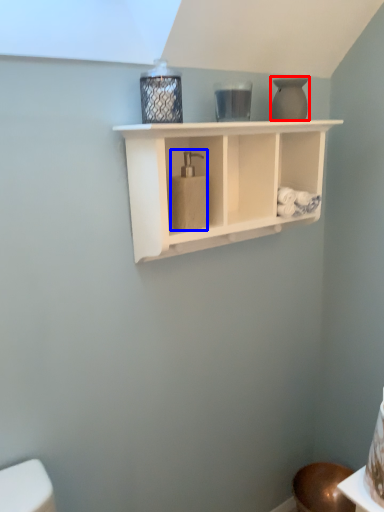
Question: Which point is closer to the camera, vase (highlighted by a red box) or soap dispenser (highlighted by a blue box)?

Choices:
 (A) vase
 (B) soap dispenser

Answer: (B)